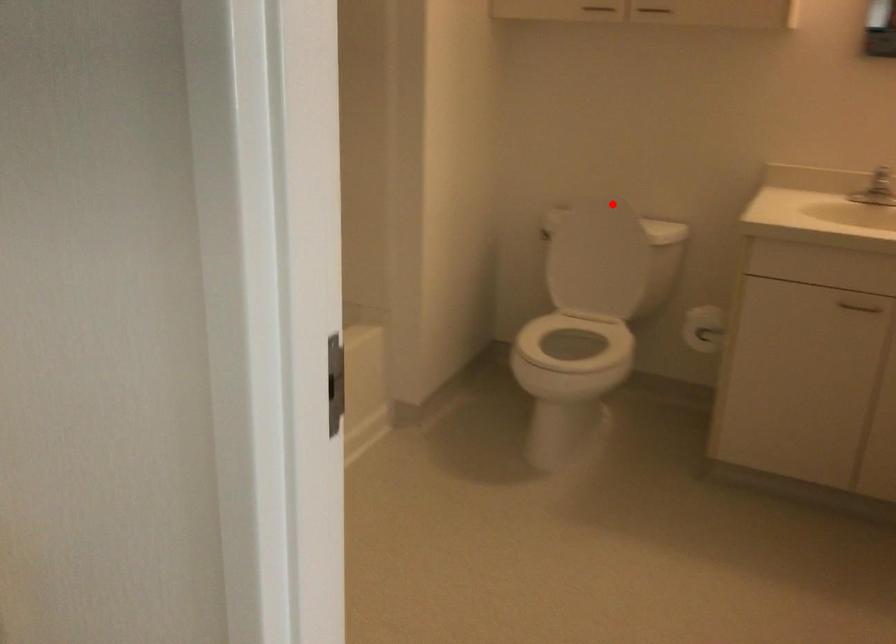
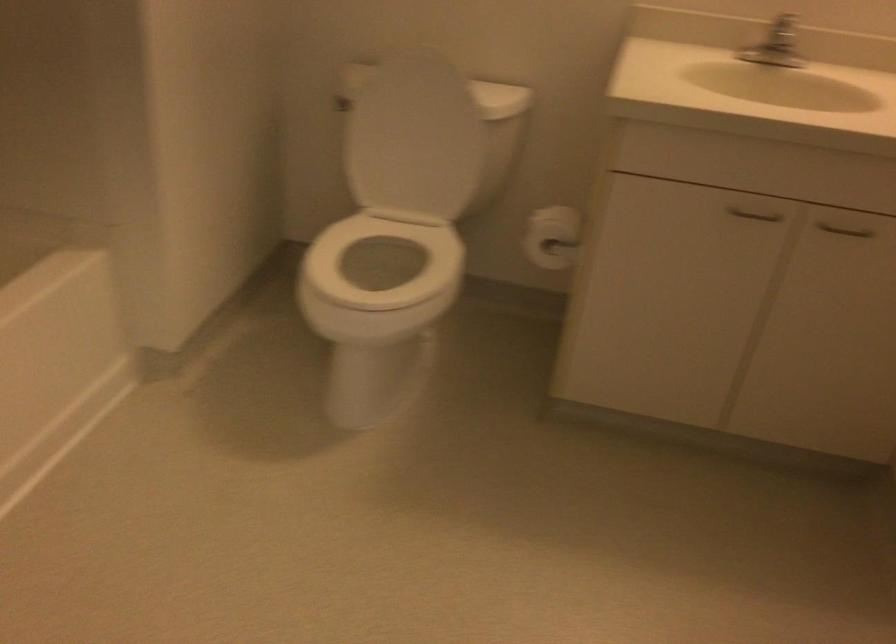
Question: I am providing you with two images of the same scene from different viewpoints. Image1 has a red point marked. In image2, the corresponding 3D location appears at what relative position? Reply with the corresponding letter.

Choices:
 (A) Closer
 (B) Farther

Answer: (A)